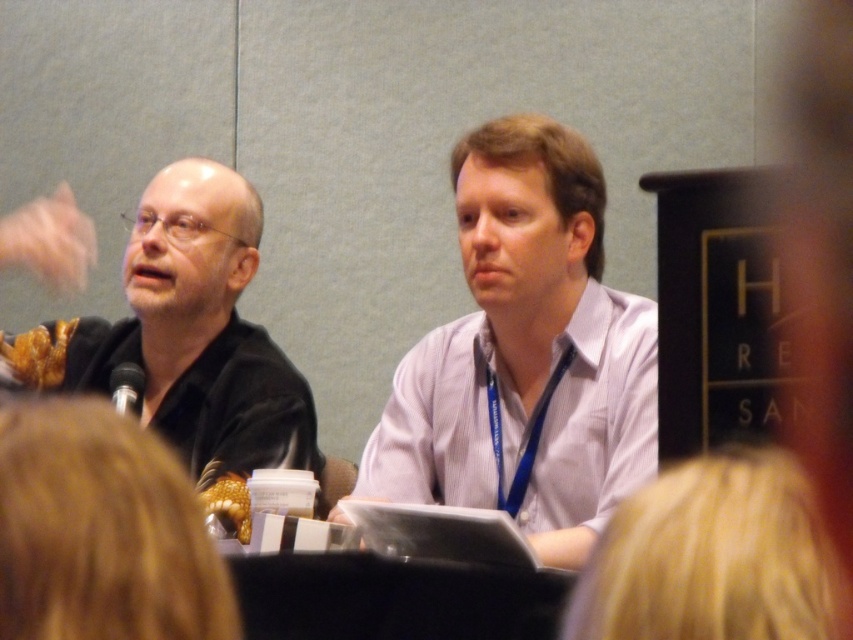
You are organizing a photo shoot and need to arrange two shirts on a table for a product display. The matte purple shirt at center and the black matte shirt at left must be placed such that their heights are accurately represented. Which shirt should you position higher on the table?

The matte purple shirt at center should be positioned higher on the table since it has a greater height compared to the black matte shirt at left according to the description.

You are organizing a photoshoot and need to position two models wearing the matte purple shirt at center and the black matte shirt at left. Based on the scene, which model should stand to the right side of the other?

The matte purple shirt at center should stand to the right of the black matte shirt at left because the description states that the matte purple shirt at center is to the right of the black matte shirt at left.

You are a photographer standing at the camera position. You want to take a closeup shot of the matte purple shirt at center. Can you reach it with a standard zoom lens that has a minimum focusing distance of 1.5 meters?

The matte purple shirt at center is 1.61 meters away from camera, so yes, the photographer can take a closeup shot with the standard zoom lens since the distance is within the lens minimum focusing distance of 1.5 meters.